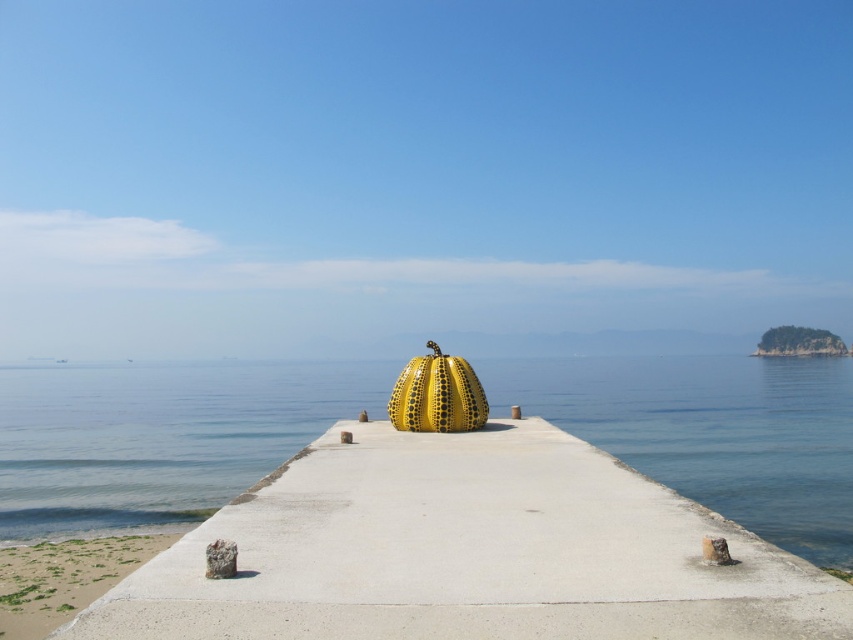
You are standing on the green grassy sand at lower left and want to walk towards the transparent blue water at center. Is there any obstacle between you and the water?

The transparent blue water at center is in front of green grassy sand at lower left, so there is no obstacle between you and the water.

You are standing on the concrete pier and want to walk to the yellow pumpkin sculpture at the end. There is a point marked at coordinates (160, 436). What is located at that point?

The point at coordinates (160, 436) is occupied by transparent blue water at center.

You are standing on the concrete pier and want to reach the yellow sculpture at the end of the pier. You notice the transparent blue water at center. Based on its position, can you estimate how far you are from the yellow sculpture?

The transparent blue water at center is located at point [160,436]. Since the sculpture is at the end of the pier, you are approximately 0.684 meters away from the yellow sculpture.